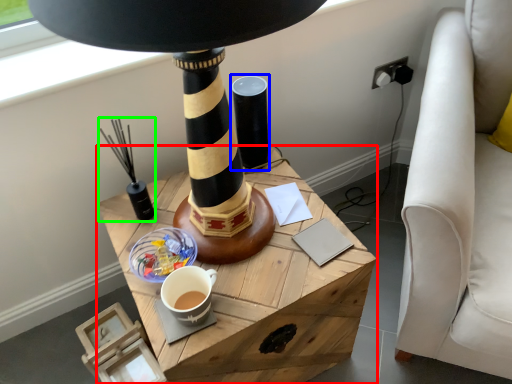
Question: Considering the real-world distances, which object is closest to table (highlighted by a red box)? candle holder (highlighted by a blue box) or candle holder (highlighted by a green box).

Choices:
 (A) candle holder
 (B) candle holder

Answer: (B)